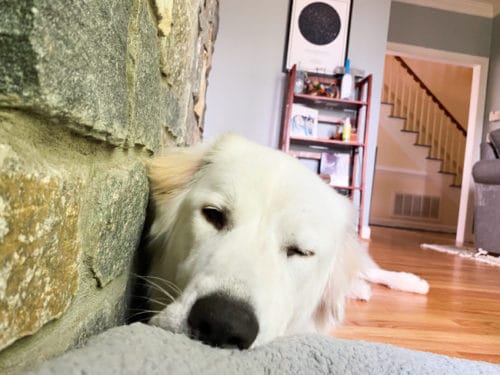
The height and width of the screenshot is (375, 500). In order to click on vent in this screenshot , I will do [x=413, y=208].